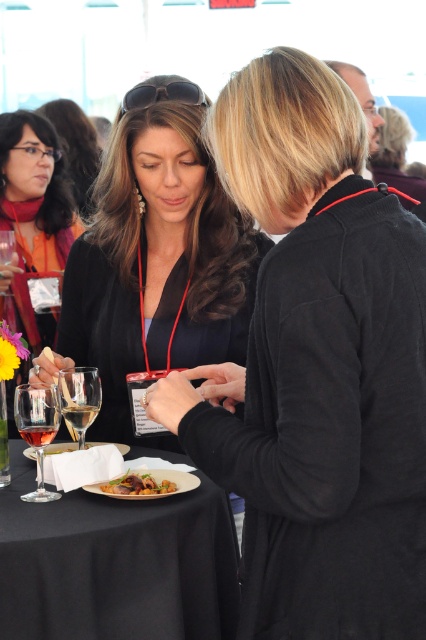
Does clear glass wine glass at lower left have a smaller size compared to translucent glass at lower left?

No.

Who is lower down, clear glass wine glass at lower left or translucent glass at lower left?

Positioned lower is translucent glass at lower left.

Where is `clear glass wine glass at lower left`? The height and width of the screenshot is (640, 426). clear glass wine glass at lower left is located at coordinates pyautogui.click(x=80, y=397).

Does translucent glass wine glass at lower left have a greater height compared to clear glass wine at center?

Indeed, translucent glass wine glass at lower left has a greater height compared to clear glass wine at center.

Who is taller, translucent glass wine glass at lower left or clear glass wine at center?

Standing taller between the two is translucent glass wine glass at lower left.

Does point (48, 426) come in front of point (89, 416)?

Yes, it is in front of point (89, 416).

Identify the location of translucent glass wine glass at lower left. The image size is (426, 640). (37, 428).

Who is higher up, matte black lanyard at left or clear glass wine glass at lower left?

matte black lanyard at left

Can you confirm if matte black lanyard at left is bigger than clear glass wine glass at lower left?

Yes, matte black lanyard at left is bigger than clear glass wine glass at lower left.

Identify the location of matte black lanyard at left. This screenshot has width=426, height=640. (34, 216).